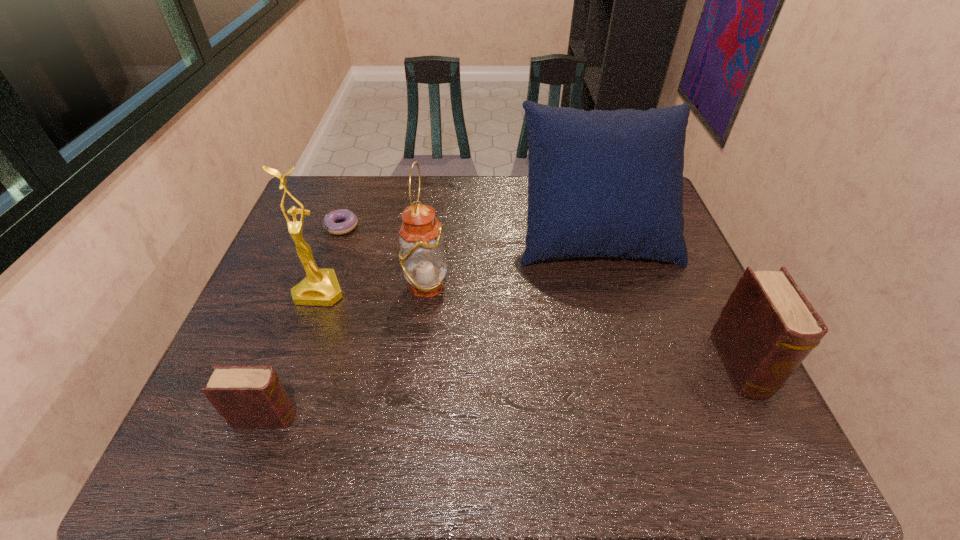
Locate an element on the screen. This screenshot has width=960, height=540. object present at the far left corner is located at coordinates (350, 223).

This screenshot has height=540, width=960. In order to click on object present at the near left corner in this screenshot , I will do `click(248, 397)`.

Find the location of `object located in the far right corner section of the desktop`. object located in the far right corner section of the desktop is located at coordinates (601, 183).

You are a GUI agent. You are given a task and a screenshot of the screen. Output one action in this format:
    pyautogui.click(x=<x>, y=<y>)
    Task: Click on the object that is at the near right corner
    The image size is (960, 540).
    Given the screenshot: What is the action you would take?
    [x=767, y=328]

Locate an element on the screen. free space at the far edge of the desktop is located at coordinates pos(483,198).

This screenshot has width=960, height=540. I want to click on vacant space at the near edge of the desktop, so click(648, 418).

Where is `blank space at the left edge`? The width and height of the screenshot is (960, 540). blank space at the left edge is located at coordinates (256, 334).

Identify the location of vacant region at the right edge. This screenshot has height=540, width=960. (680, 275).

The image size is (960, 540). Find the location of `vacant area at the near right corner`. vacant area at the near right corner is located at coordinates (692, 394).

This screenshot has height=540, width=960. I want to click on free spot between the shorter diary and the award, so click(x=294, y=354).